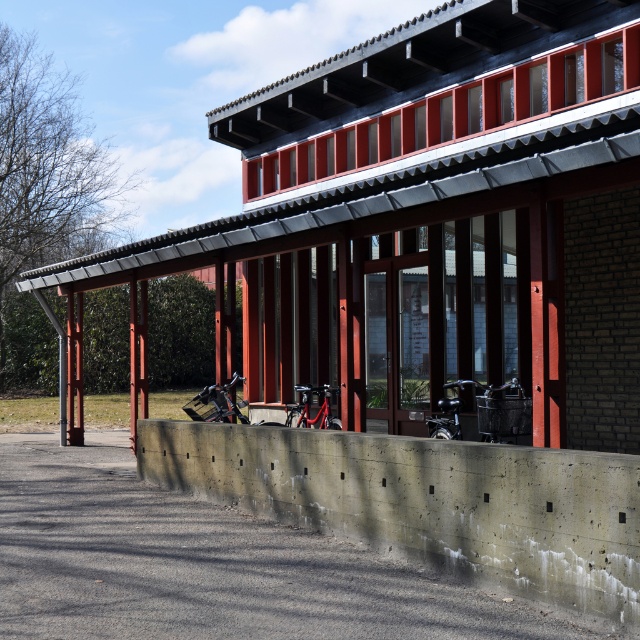
Which of these two, concrete at lower center or shiny metallic motorcycle at center, stands taller?

Standing taller between the two is concrete at lower center.

In order to click on concrete at lower center in this screenshot , I will do `click(426, 225)`.

Does concrete at lower center have a larger size compared to metallic silver motorcycle at center?

Correct, concrete at lower center is larger in size than metallic silver motorcycle at center.

Does point (259, 324) come behind point (189, 403)?

Yes, point (259, 324) is farther from viewer.

You are a GUI agent. You are given a task and a screenshot of the screen. Output one action in this format:
    pyautogui.click(x=<x>, y=<y>)
    Task: Click on the concrete at lower center
    The image size is (640, 640).
    Given the screenshot: What is the action you would take?
    pyautogui.click(x=426, y=225)

Between metallic silver motorcycle at center and shiny black motorcycle at center, which one has less height?

shiny black motorcycle at center is shorter.

Between point (214, 400) and point (442, 420), which one is positioned behind?

Positioned behind is point (214, 400).

Who is more forward, (200, 392) or (436, 404)?

Positioned in front is point (436, 404).

Locate an element on the screen. metallic silver motorcycle at center is located at coordinates (216, 403).